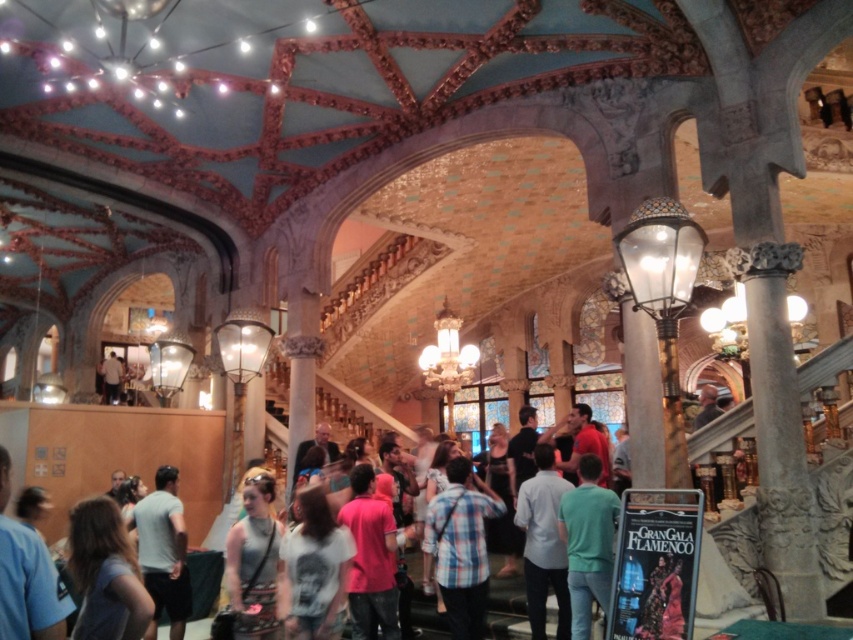
This screenshot has width=853, height=640. What do you see at coordinates (370, 557) in the screenshot?
I see `pink matte shirt at center` at bounding box center [370, 557].

In the scene shown: Between pink matte shirt at center and gray cotton t-shirt at lower left, which one has more height?

Standing taller between the two is gray cotton t-shirt at lower left.

Locate an element on the screen. This screenshot has height=640, width=853. pink matte shirt at center is located at coordinates click(x=370, y=557).

Locate an element on the screen. The height and width of the screenshot is (640, 853). pink matte shirt at center is located at coordinates (370, 557).

Can you confirm if plaid fabric shirt at center is positioned above gray cotton shirt at lower left?

Actually, plaid fabric shirt at center is below gray cotton shirt at lower left.

You are a GUI agent. You are given a task and a screenshot of the screen. Output one action in this format:
    pyautogui.click(x=<x>, y=<y>)
    Task: Click on the plaid fabric shirt at center
    The width and height of the screenshot is (853, 640).
    Given the screenshot: What is the action you would take?
    pyautogui.click(x=459, y=547)

Is white matte shirt at center further to camera compared to green matte shirt at center?

Yes.

Locate an element on the screen. This screenshot has height=640, width=853. white matte shirt at center is located at coordinates (315, 568).